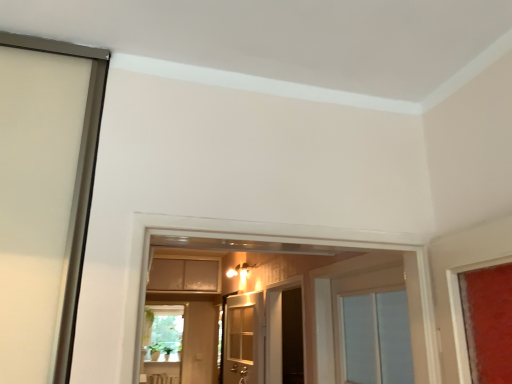
Question: Is dark wood screen door at center positioned in front of white wooden door at center?

Choices:
 (A) yes
 (B) no

Answer: (B)

Question: Does dark wood screen door at center have a greater width compared to white wooden door at center?

Choices:
 (A) no
 (B) yes

Answer: (B)

Question: Is dark wood screen door at center positioned with its back to white wooden door at center?

Choices:
 (A) yes
 (B) no

Answer: (B)

Question: Could white wooden door at center be considered to be inside dark wood screen door at center?

Choices:
 (A) yes
 (B) no

Answer: (B)

Question: Is the position of dark wood screen door at center more distant than that of white wooden door at center?

Choices:
 (A) no
 (B) yes

Answer: (B)

Question: Considering the positions of matte beige cabinet at center and dark wood screen door at center in the image, is matte beige cabinet at center wider or thinner than dark wood screen door at center?

Choices:
 (A) thin
 (B) wide

Answer: (B)

Question: Considering the positions of matte beige cabinet at center and dark wood screen door at center in the image, is matte beige cabinet at center bigger or smaller than dark wood screen door at center?

Choices:
 (A) small
 (B) big

Answer: (B)

Question: Is point (218, 286) positioned closer to the camera than point (270, 340)?

Choices:
 (A) closer
 (B) farther

Answer: (B)

Question: Is matte beige cabinet at center in front of or behind dark wood screen door at center in the image?

Choices:
 (A) front
 (B) behind

Answer: (B)

Question: Is dark wood screen door at center in front of or behind white wooden door at center in the image?

Choices:
 (A) behind
 (B) front

Answer: (A)

Question: From the image's perspective, is dark wood screen door at center positioned above or below white wooden door at center?

Choices:
 (A) above
 (B) below

Answer: (B)

Question: Looking at their shapes, would you say dark wood screen door at center is wider or thinner than white wooden door at center?

Choices:
 (A) wide
 (B) thin

Answer: (A)

Question: From a real-world perspective, relative to white wooden door at center, is dark wood screen door at center vertically above or below?

Choices:
 (A) above
 (B) below

Answer: (A)

Question: Is matte beige cabinet at center taller or shorter than white wooden door at center?

Choices:
 (A) short
 (B) tall

Answer: (A)

Question: Considering the positions of matte beige cabinet at center and white wooden door at center in the image, is matte beige cabinet at center wider or thinner than white wooden door at center?

Choices:
 (A) wide
 (B) thin

Answer: (A)